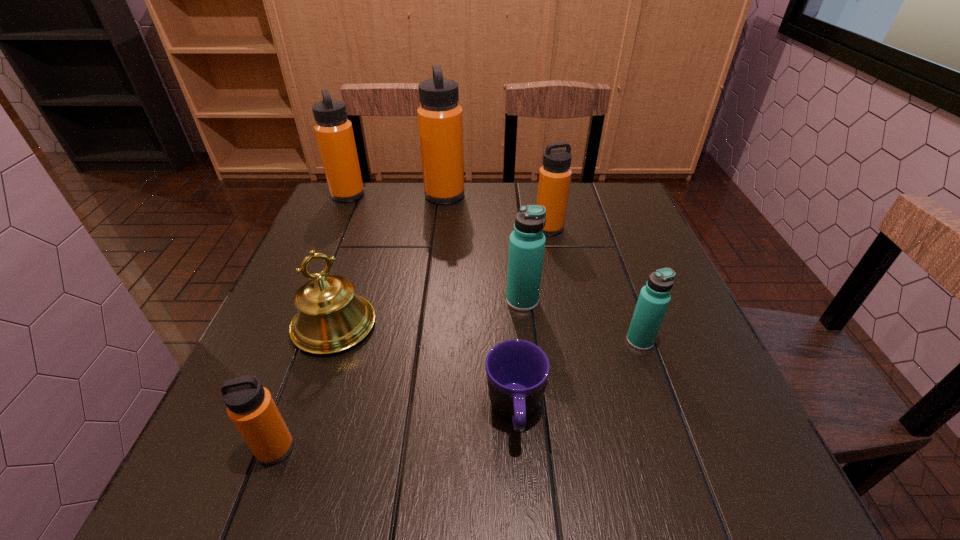
The width and height of the screenshot is (960, 540). In order to click on the smaller aqua thermos bottle in this screenshot , I will do `click(654, 298)`.

This screenshot has width=960, height=540. I want to click on the smallest orange thermos bottle, so click(250, 406).

Find the location of `the nearest thermos bottle`. the nearest thermos bottle is located at coordinates (250, 406).

You are a GUI agent. You are given a task and a screenshot of the screen. Output one action in this format:
    pyautogui.click(x=<x>, y=<y>)
    Task: Click on the mug
    The width and height of the screenshot is (960, 540).
    Given the screenshot: What is the action you would take?
    pyautogui.click(x=517, y=370)

The width and height of the screenshot is (960, 540). I want to click on the shortest object, so click(517, 370).

Where is `blank space located on the left of the fourth thermos bottle from right to left`? blank space located on the left of the fourth thermos bottle from right to left is located at coordinates (385, 195).

Locate an element on the screen. The height and width of the screenshot is (540, 960). free space located 0.330m on the right of the seventh shortest object is located at coordinates (474, 195).

Locate an element on the screen. Image resolution: width=960 pixels, height=540 pixels. free space located on the left of the sixth nearest object is located at coordinates (430, 228).

Where is `vacant space located 0.130m on the back of the left aqua thermos bottle`? This screenshot has height=540, width=960. vacant space located 0.130m on the back of the left aqua thermos bottle is located at coordinates click(517, 254).

What are the coordinates of `free region located 0.220m on the right of the gold bell` in the screenshot? It's located at (481, 325).